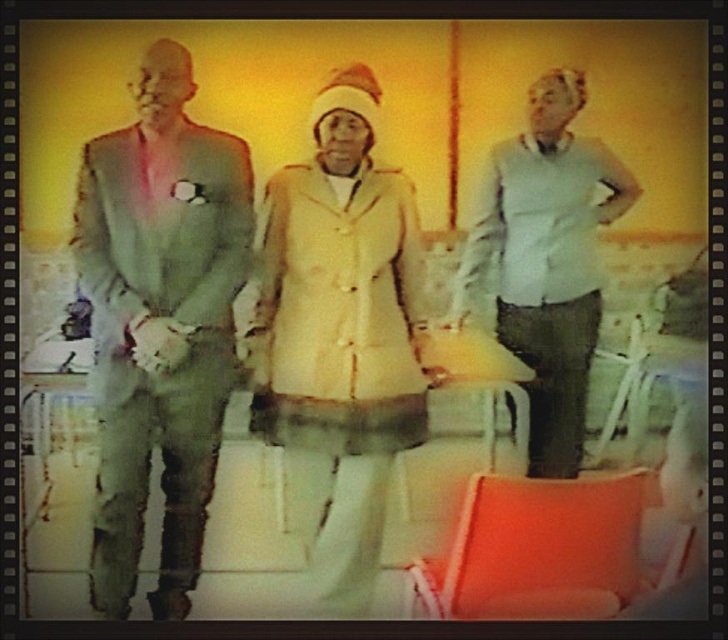
You are a tailor who needs to determine which of the two garments, the matte gray suit at left or the light blue sweater at center, requires more fabric for alterations. Based on the image, which garment would you prioritize for requiring more fabric?

The light blue sweater at center requires more fabric for alterations because it is thicker than the matte gray suit at left.

In the vintage photograph, there are two points marked at coordinates point (348, 268) and point (494, 147). Which of these points is nearer to the viewer?

Point (348, 268) is closer to the viewer than point (494, 147).